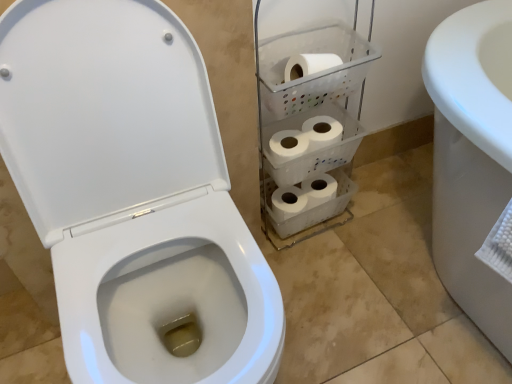
Where is `white matte toilet paper at center`? This screenshot has width=512, height=384. white matte toilet paper at center is located at coordinates (309, 64).

Where is `white plastic shelf at center`? white plastic shelf at center is located at coordinates (309, 119).

What's the angular difference between white plastic shelf at center and white matte toilet paper at center's facing directions?

white plastic shelf at center and white matte toilet paper at center are facing 0.00324 degrees away from each other.

Does point (293, 189) come behind point (301, 59)?

Yes, point (293, 189) is farther from viewer.

From the image's perspective, is white plastic shelf at center above or below white matte toilet paper at center?

Based on their image positions, white plastic shelf at center is located beneath white matte toilet paper at center.

Would you say white plastic shelf at center is inside or outside white matte toilet paper at center?

white plastic shelf at center lies outside white matte toilet paper at center.

Which is more to the left, white glossy toilet at left or white matte toilet paper at center?

From the viewer's perspective, white glossy toilet at left appears more on the left side.

Is white matte toilet paper at center at the back of white glossy toilet at left?

white glossy toilet at left does not have its back to white matte toilet paper at center.

From the image's perspective, is white glossy toilet at left above white matte toilet paper at center?

No, from the image's perspective, white glossy toilet at left is not over white matte toilet paper at center.

Is point (176, 135) closer or farther from the camera than point (290, 65)?

Point (176, 135) is positioned closer to the camera compared to point (290, 65).

Considering the positions of objects white glossy toilet at left and white plastic shelf at center in the image provided, who is behind, white glossy toilet at left or white plastic shelf at center?

white plastic shelf at center is further from the camera.

Which of these two, white glossy toilet at left or white plastic shelf at center, stands shorter?

With less height is white plastic shelf at center.

Could you tell me if white glossy toilet at left is turned towards white plastic shelf at center?

No, white glossy toilet at left is not turned towards white plastic shelf at center.

Is white glossy toilet at left far from white plastic shelf at center?

They are positioned close to each other.

In the scene shown: Considering the sizes of white plastic shelf at center and white glossy toilet at left in the image, is white plastic shelf at center wider or thinner than white glossy toilet at left?

Clearly, white plastic shelf at center has less width compared to white glossy toilet at left.

From the image's perspective, is white plastic shelf at center above or below white glossy toilet at left?

Clearly, from the image's perspective, white plastic shelf at center is above white glossy toilet at left.

From a real-world perspective, relative to white glossy toilet at left, is white plastic shelf at center vertically above or below?

Clearly, from a real-world perspective, white plastic shelf at center is below white glossy toilet at left.

Based on their sizes in the image, would you say white plastic shelf at center is bigger or smaller than white glossy toilet at left?

Clearly, white plastic shelf at center is smaller in size than white glossy toilet at left.

Consider the image. From the image's perspective, is white matte toilet paper at center on white plastic shelf at center?

Yes.

Considering the relative sizes of white matte toilet paper at center and white plastic shelf at center in the image provided, is white matte toilet paper at center thinner than white plastic shelf at center?

Yes, white matte toilet paper at center is thinner than white plastic shelf at center.

In the image, is white matte toilet paper at center on the left side or the right side of white plastic shelf at center?

Based on their positions, white matte toilet paper at center is located to the left of white plastic shelf at center.

Which is closer, (332, 59) or (275, 280)?

Point (275, 280)

Is white matte toilet paper at center further to camera compared to white glossy toilet at left?

Yes, the depth of white matte toilet paper at center is greater than that of white glossy toilet at left.

In the image, is white matte toilet paper at center on the left side or the right side of white glossy toilet at left?

From the image, it's evident that white matte toilet paper at center is to the right of white glossy toilet at left.

Considering the relative sizes of white matte toilet paper at center and white glossy toilet at left in the image provided, is white matte toilet paper at center smaller than white glossy toilet at left?

Indeed, white matte toilet paper at center has a smaller size compared to white glossy toilet at left.

Identify the location of to paper above the white plastic shelf at center (from a real-world perspective). The height and width of the screenshot is (384, 512). (309, 64).

In the image, there is a white glossy toilet at left. Find the location of `to paper above it (from the image's perspective)`. to paper above it (from the image's perspective) is located at coordinates (309, 64).

Looking at the image, which one is located further to white plastic shelf at center, white glossy toilet at left or white matte toilet paper at center?

white glossy toilet at left is further to white plastic shelf at center.

Estimate the real-world distances between objects in this image. Which object is closer to white plastic shelf at center, white matte toilet paper at center or white glossy toilet at left?

Among the two, white matte toilet paper at center is located nearer to white plastic shelf at center.

Based on their spatial positions, is white matte toilet paper at center or white plastic shelf at center further from white glossy toilet at left?

Among the two, white matte toilet paper at center is located further to white glossy toilet at left.

In the scene shown: Looking at the image, which one is located closer to white glossy toilet at left, white plastic shelf at center or white matte toilet paper at center?

white plastic shelf at center is closer to white glossy toilet at left.

From the image, which object appears to be nearer to white matte toilet paper at center, white plastic shelf at center or white glossy toilet at left?

white plastic shelf at center lies closer to white matte toilet paper at center than the other object.

Considering their positions, is white glossy toilet at left positioned closer to white matte toilet paper at center than white plastic shelf at center?

The object closer to white matte toilet paper at center is white plastic shelf at center.

The height and width of the screenshot is (384, 512). In order to click on shelf between white glossy toilet at left and white matte toilet paper at center along the z-axis in this screenshot , I will do `click(309, 119)`.